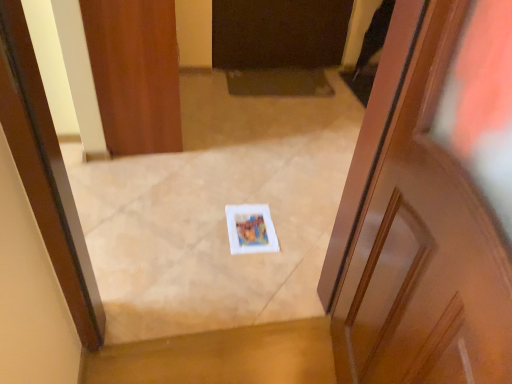
What do you see at coordinates (431, 211) in the screenshot? I see `wooden door at center, which is the 1th door from right to left` at bounding box center [431, 211].

What is the approximate width of wooden door at center, the second door from the left?

It is 5.68 inches.

Locate an element on the screen. This screenshot has height=384, width=512. wooden door at center, the 2th door viewed from the top is located at coordinates (431, 211).

You are a GUI agent. You are given a task and a screenshot of the screen. Output one action in this format:
    pyautogui.click(x=<x>, y=<y>)
    Task: Click on the wooden door at upper left, arranged as the 2th door when viewed from the right
    Image resolution: width=512 pixels, height=384 pixels.
    Given the screenshot: What is the action you would take?
    pyautogui.click(x=135, y=73)

How much space does wooden door at upper left, marked as the 2th door in a bottom-to-top arrangement, occupy vertically?

wooden door at upper left, marked as the 2th door in a bottom-to-top arrangement, is 32.01 inches tall.

What do you see at coordinates (135, 73) in the screenshot? This screenshot has height=384, width=512. I see `wooden door at upper left, arranged as the 2th door when viewed from the right` at bounding box center [135, 73].

Find the location of `wooden door at center, the second door from the back`. wooden door at center, the second door from the back is located at coordinates (431, 211).

Considering the positions of objects wooden door at upper left, arranged as the 1th door when viewed from the back, and wooden door at center, the 2th door viewed from the top, in the image provided, who is more to the right, wooden door at upper left, arranged as the 1th door when viewed from the back, or wooden door at center, the 2th door viewed from the top,?

wooden door at center, the 2th door viewed from the top.

Which is behind, wooden door at upper left, arranged as the 1th door when viewed from the back, or wooden door at center, the second door from the back?

wooden door at upper left, arranged as the 1th door when viewed from the back, is further from the camera.

Does point (105, 16) appear closer or farther from the camera than point (393, 226)?

Point (105, 16) is positioned farther from the camera compared to point (393, 226).

From the image's perspective, between wooden door at upper left, arranged as the 2th door when viewed from the right, and wooden door at center, the 2th door viewed from the top, which one is located above?

wooden door at upper left, arranged as the 2th door when viewed from the right, is shown above in the image.

From a real-world perspective, is wooden door at upper left, which appears as the 1th door when viewed from the top, positioned above or below wooden door at center, the first door positioned from the bottom?

Clearly, from a real-world perspective, wooden door at upper left, which appears as the 1th door when viewed from the top, is below wooden door at center, the first door positioned from the bottom.

Which object is wider, wooden door at upper left, arranged as the 2th door when viewed from the right, or wooden door at center, the first door viewed from the front?

Wider between the two is wooden door at upper left, arranged as the 2th door when viewed from the right.

In terms of height, does wooden door at upper left, which is the first door from left to right, look taller or shorter compared to wooden door at center, the first door positioned from the bottom?

Considering their sizes, wooden door at upper left, which is the first door from left to right, has less height than wooden door at center, the first door positioned from the bottom.

Can you confirm if wooden door at upper left, arranged as the 2th door when viewed from the right, is bigger than wooden door at center, the second door from the back?

Indeed, wooden door at upper left, arranged as the 2th door when viewed from the right, has a larger size compared to wooden door at center, the second door from the back.

Is wooden door at upper left, arranged as the 2th door when viewed from the right, inside the boundaries of wooden door at center, the 2th door viewed from the top, or outside?

wooden door at upper left, arranged as the 2th door when viewed from the right, is located beyond the bounds of wooden door at center, the 2th door viewed from the top.

Is wooden door at upper left, which is the first door from left to right, beside wooden door at center, which is the 1th door from right to left?

No, wooden door at upper left, which is the first door from left to right, is not next to wooden door at center, which is the 1th door from right to left.

Does wooden door at upper left, arranged as the 1th door when viewed from the back, turn towards wooden door at center, the 2th door viewed from the top?

No.

Identify the location of door below the wooden door at upper left, the second door from the front (from the image's perspective). (431, 211).

Considering the positions of objects wooden door at center, the 2th door viewed from the top, and wooden door at upper left, which is the first door from left to right, in the image provided, who is more to the right, wooden door at center, the 2th door viewed from the top, or wooden door at upper left, which is the first door from left to right,?

From the viewer's perspective, wooden door at center, the 2th door viewed from the top, appears more on the right side.

Does wooden door at center, the 2th door viewed from the top, lie behind wooden door at upper left, arranged as the 1th door when viewed from the back?

No, wooden door at center, the 2th door viewed from the top, is closer to the camera.

Considering the points (480, 146) and (115, 91), which point is in front, point (480, 146) or point (115, 91)?

Point (480, 146)

From the image's perspective, would you say wooden door at center, the 2th door viewed from the top, is positioned over wooden door at upper left, arranged as the 2th door when viewed from the right?

No, from the image's perspective, wooden door at center, the 2th door viewed from the top, is not on top of wooden door at upper left, arranged as the 2th door when viewed from the right.

From a real-world perspective, who is located lower, wooden door at center, the 2th door viewed from the top, or wooden door at upper left, the second door from the front?

In real-world perspective, wooden door at upper left, the second door from the front, is lower.

Between wooden door at center, the first door viewed from the front, and wooden door at upper left, arranged as the 1th door when viewed from the back, which one has smaller width?

Thinner between the two is wooden door at center, the first door viewed from the front.

Is wooden door at center, the 2th door viewed from the top, taller than wooden door at upper left, which is the first door from left to right?

Yes.

Based on their sizes in the image, would you say wooden door at center, the second door from the back, is bigger or smaller than wooden door at upper left, which appears as the 1th door when viewed from the top?

In the image, wooden door at center, the second door from the back, appears to be smaller than wooden door at upper left, which appears as the 1th door when viewed from the top.

Would you say wooden door at upper left, arranged as the 1th door when viewed from the back, is part of wooden door at center, the first door viewed from the front,'s contents?

That's incorrect, wooden door at upper left, arranged as the 1th door when viewed from the back, is not inside wooden door at center, the first door viewed from the front.

Is wooden door at center, the first door viewed from the front, far from wooden door at upper left, the second door from the front?

Yes, wooden door at center, the first door viewed from the front, and wooden door at upper left, the second door from the front, are quite far apart.

Is wooden door at upper left, which appears as the 1th door when viewed from the top, at the back of wooden door at center, the first door positioned from the bottom?

No, wooden door at upper left, which appears as the 1th door when viewed from the top, is not at the back of wooden door at center, the first door positioned from the bottom.

You are a GUI agent. You are given a task and a screenshot of the screen. Output one action in this format:
    pyautogui.click(x=<x>, y=<y>)
    Task: Click on the door behind the wooden door at center, the second door from the back
    Image resolution: width=512 pixels, height=384 pixels.
    Given the screenshot: What is the action you would take?
    pyautogui.click(x=135, y=73)

Locate an element on the screen. The height and width of the screenshot is (384, 512). door behind the wooden door at center, the 2th door viewed from the top is located at coordinates (x=135, y=73).

Identify the location of door above the wooden door at upper left, arranged as the 1th door when viewed from the back (from a real-world perspective). (431, 211).